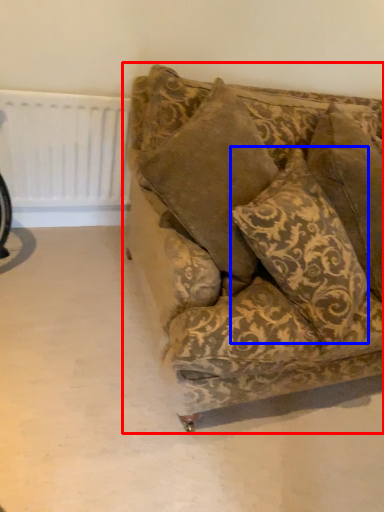
Question: Which of the following is the closest to the observer, studio couch (highlighted by a red box) or pillow (highlighted by a blue box)?

Choices:
 (A) studio couch
 (B) pillow

Answer: (A)